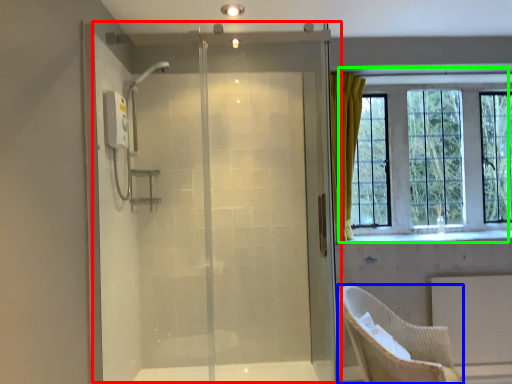
Question: Which object is the closest to the screen door (highlighted by a red box)? Choose among these: chair (highlighted by a blue box) or window (highlighted by a green box).

Choices:
 (A) chair
 (B) window

Answer: (A)